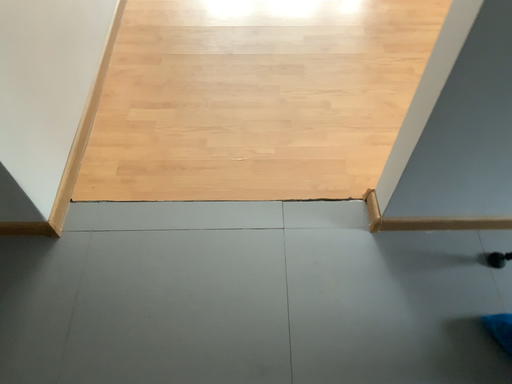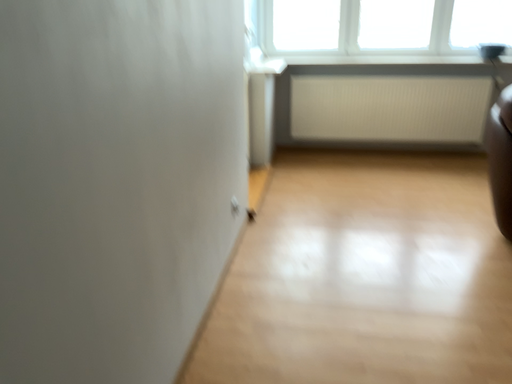
Question: Which way did the camera rotate in the video?

Choices:
 (A) rotated right
 (B) rotated left

Answer: (B)